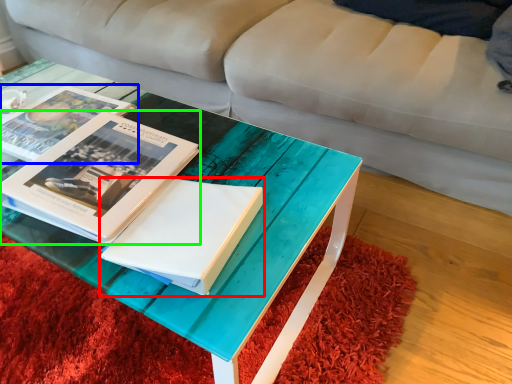
Question: Which object is positioned closest to paperback book (highlighted by a red box)? Select from book (highlighted by a blue box) and book (highlighted by a green box).

Choices:
 (A) book
 (B) book

Answer: (B)